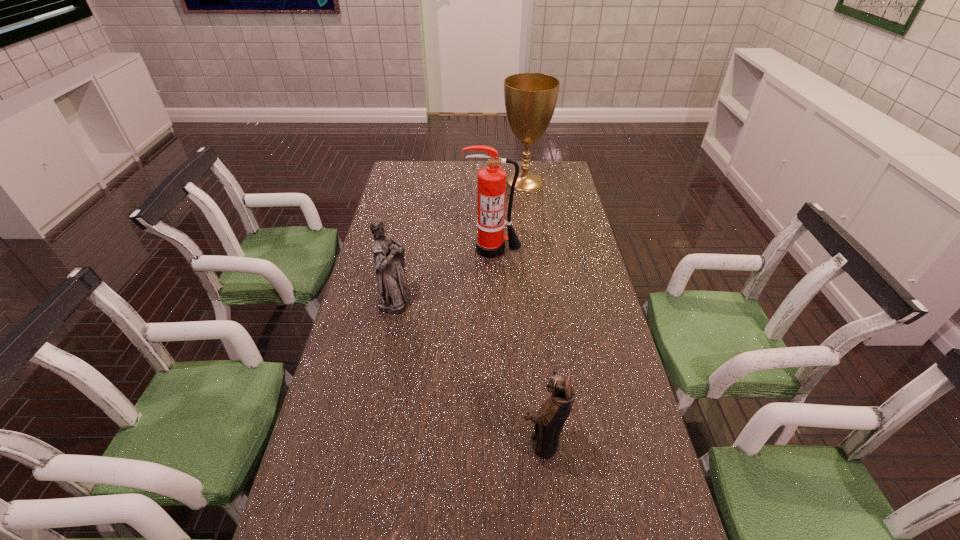
The width and height of the screenshot is (960, 540). I want to click on free space that satisfies the following two spatial constraints: 1. on the front side of the farthest object; 2. on the front-facing side of the nearest object, so click(563, 441).

Locate an element on the screen. free location that satisfies the following two spatial constraints: 1. on the front side of the trophy cup; 2. on the front-facing side of the second nearest object is located at coordinates (541, 297).

The image size is (960, 540). I want to click on vacant space that satisfies the following two spatial constraints: 1. at the nozzle of the fire extinguisher; 2. on the front-facing side of the third farthest object, so click(x=494, y=297).